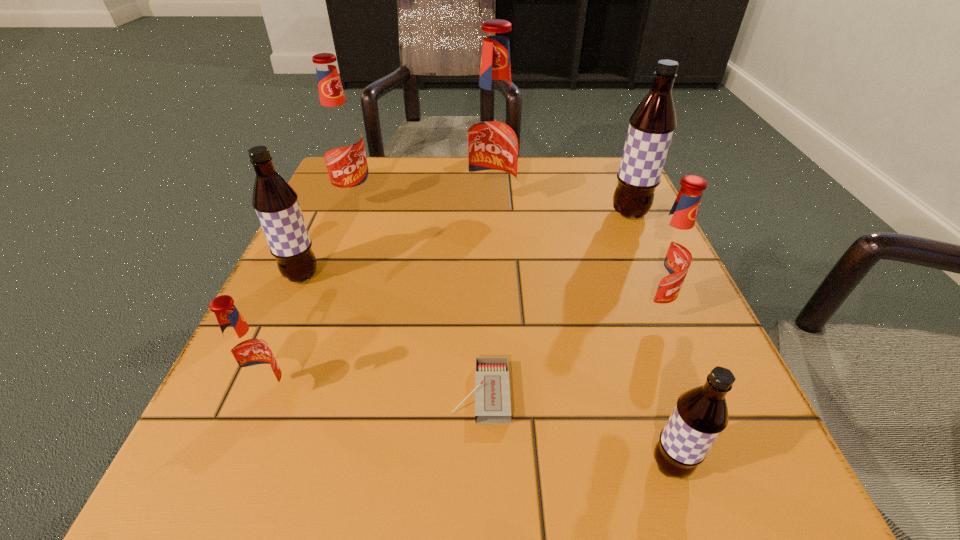
At what (x,y) coordinates should I click in order to perform the action: click on vacant region between the fourth nearest object and the nearest root beer. Please return your answer as a coordinate pair (x, y). Looking at the image, I should click on (660, 387).

What are the coordinates of `free point between the tallest object and the second nearest root beer` in the screenshot? It's located at (381, 303).

Where is `vacant space that is in between the second biggest red root beer and the nearest root beer`? This screenshot has width=960, height=540. vacant space that is in between the second biggest red root beer and the nearest root beer is located at coordinates (513, 333).

The image size is (960, 540). I want to click on free spot between the second biggest red root beer and the fourth farthest object, so [328, 239].

This screenshot has width=960, height=540. I want to click on free space between the second biggest red root beer and the second smallest red root beer, so click(x=502, y=256).

The image size is (960, 540). Identify the location of unoccupied position between the second nearest root beer and the fourth farthest object. (286, 335).

Where is `object that ranks as the closest to the third smallest red root beer`? The width and height of the screenshot is (960, 540). object that ranks as the closest to the third smallest red root beer is located at coordinates (276, 203).

Select which object appears as the third closest to the biggest red root beer. Please provide its 2D coordinates. Your answer should be formatted as a tuple, i.e. [(x, y)], where the tuple contains the x and y coordinates of a point satisfying the conditions above.

[(668, 255)]

Identify which root beer is the fourth closest to the fifth farthest object. Please provide its 2D coordinates. Your answer should be formatted as a tuple, i.e. [(x, y)], where the tuple contains the x and y coordinates of a point satisfying the conditions above.

[(248, 355)]

Find the location of a particular element. The height and width of the screenshot is (540, 960). root beer identified as the closest to the matchbox is located at coordinates (701, 414).